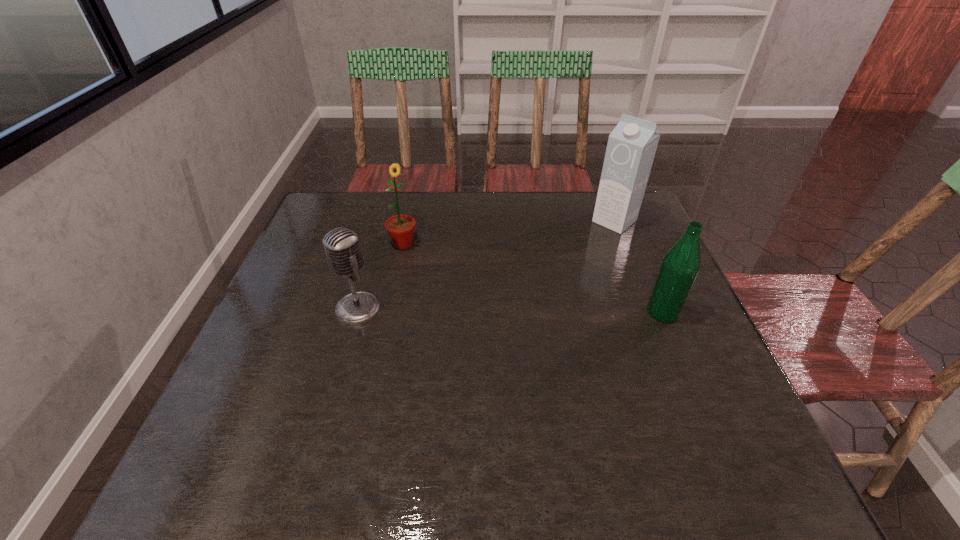
The width and height of the screenshot is (960, 540). I want to click on free space located 0.220m on the front label of the farthest object, so click(560, 267).

This screenshot has height=540, width=960. Find the location of `free region located on the front label of the farthest object`. free region located on the front label of the farthest object is located at coordinates (587, 245).

Identify the location of vacant space located on the front label of the farthest object. The height and width of the screenshot is (540, 960). (535, 288).

Find the location of a particular element. The image size is (960, 540). sunflower that is positioned at the far edge is located at coordinates (401, 228).

Locate an element on the screen. Image resolution: width=960 pixels, height=540 pixels. carton that is positioned at the far edge is located at coordinates (631, 147).

Locate an element on the screen. The width and height of the screenshot is (960, 540). bottle located in the right edge section of the desktop is located at coordinates (680, 265).

I want to click on carton at the right edge, so click(x=631, y=147).

Find the location of `object that is at the far right corner`. object that is at the far right corner is located at coordinates (631, 147).

The height and width of the screenshot is (540, 960). In order to click on free spot at the left edge of the desktop in this screenshot , I will do `click(299, 256)`.

At what (x,y) coordinates should I click in order to perform the action: click on vacant space at the right edge of the desktop. Please return your answer as a coordinate pair (x, y). Looking at the image, I should click on (714, 371).